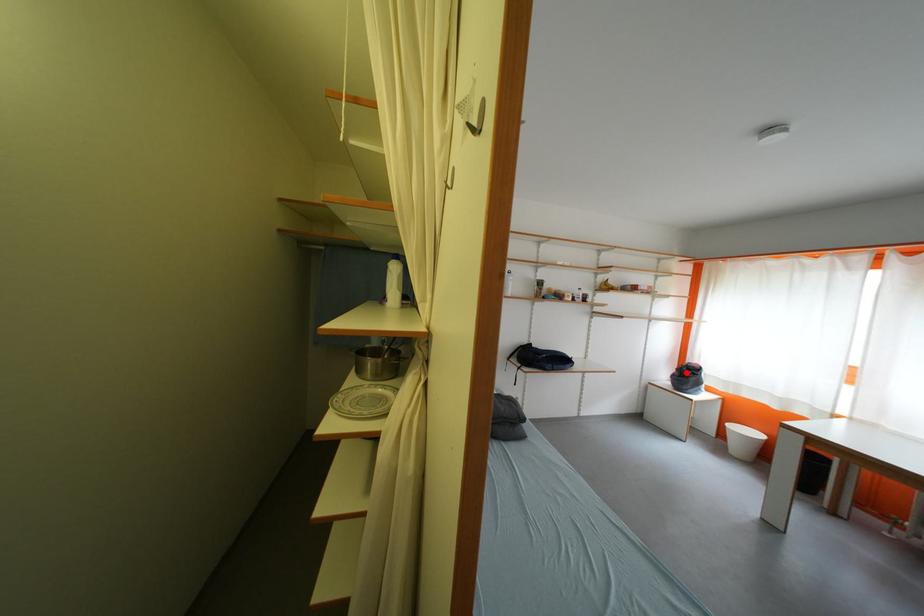
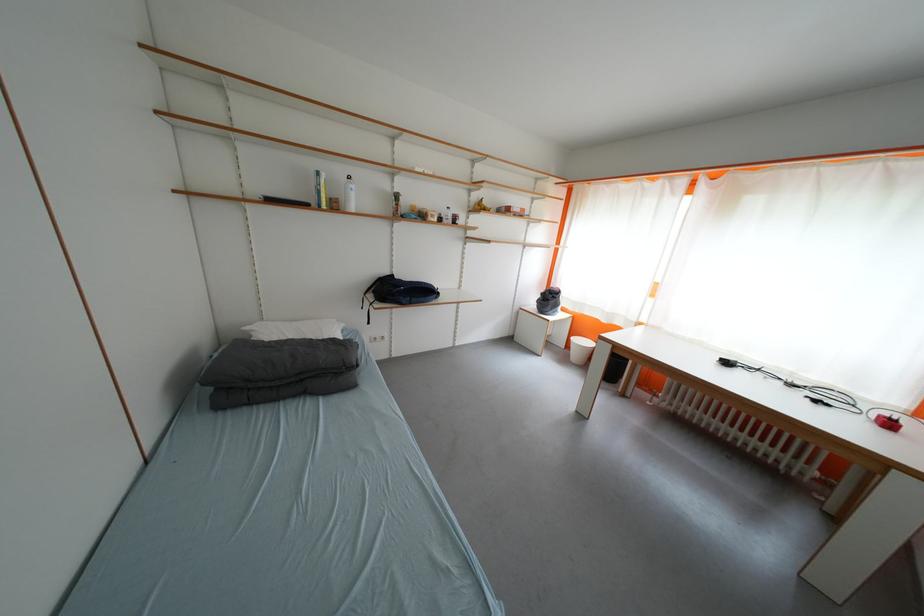
Find the pixel in the second image that matches the highlighted location in the first image.

(551, 297)